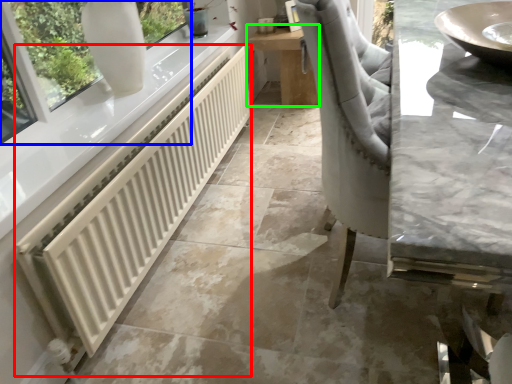
Question: Considering the real-world distances, which object is closest to radiator (highlighted by a red box)? window (highlighted by a blue box) or table (highlighted by a green box).

Choices:
 (A) window
 (B) table

Answer: (A)